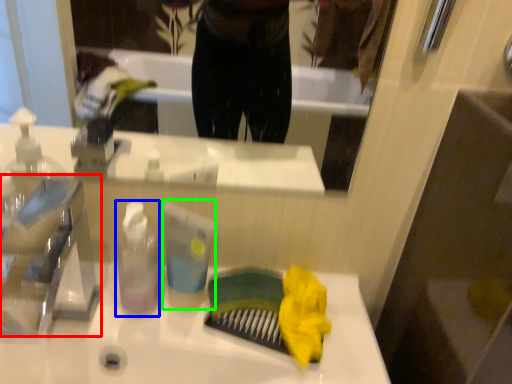
Question: Considering the real-world distances, which object is closest to faucet (highlighted by a red box)? bottle (highlighted by a blue box) or toiletry (highlighted by a green box).

Choices:
 (A) bottle
 (B) toiletry

Answer: (A)